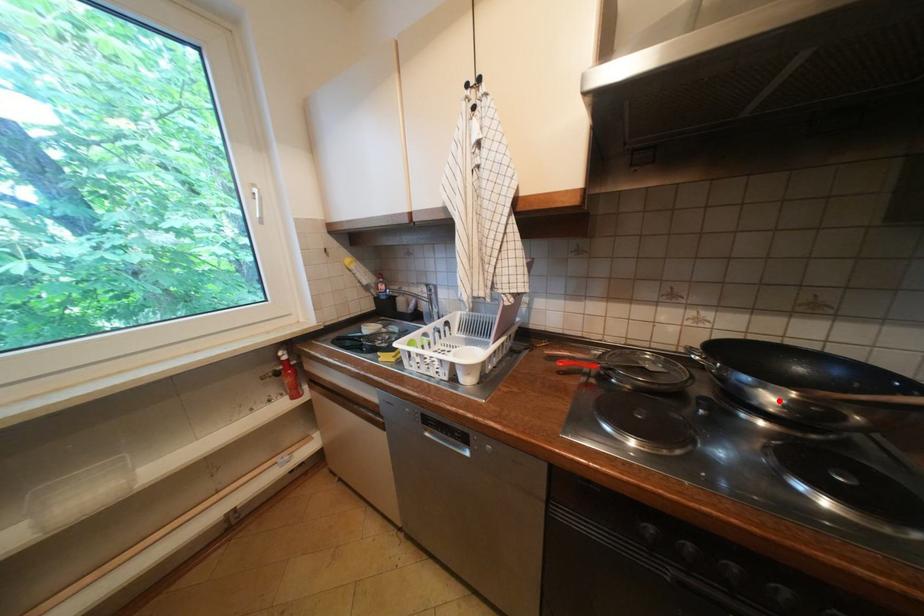
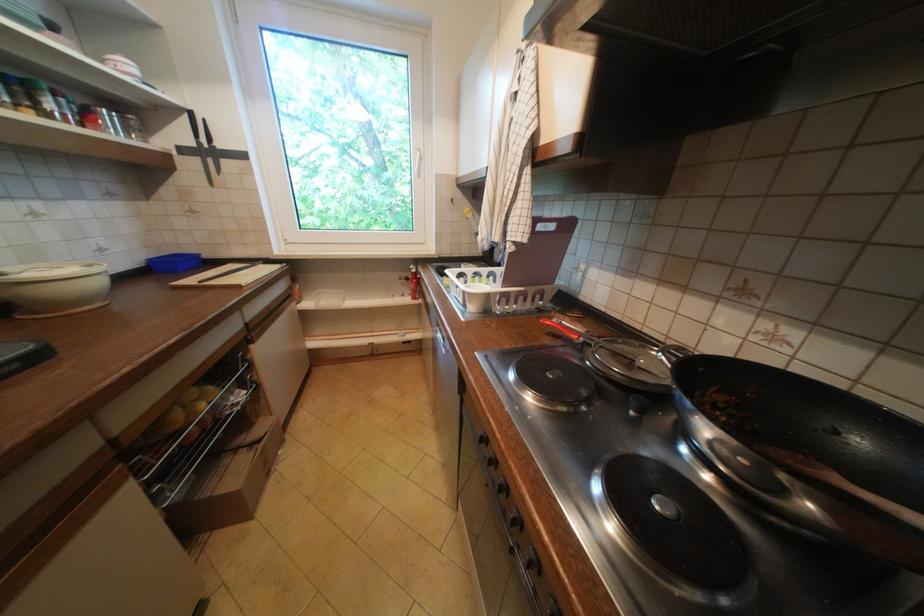
Locate, in the second image, the point that corresponds to the highlighted location in the first image.

(715, 430)